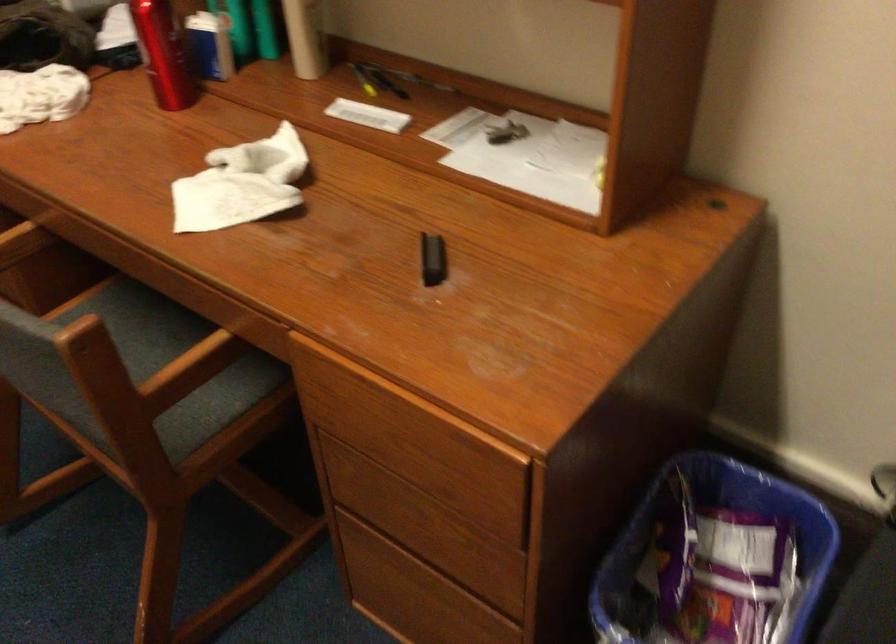
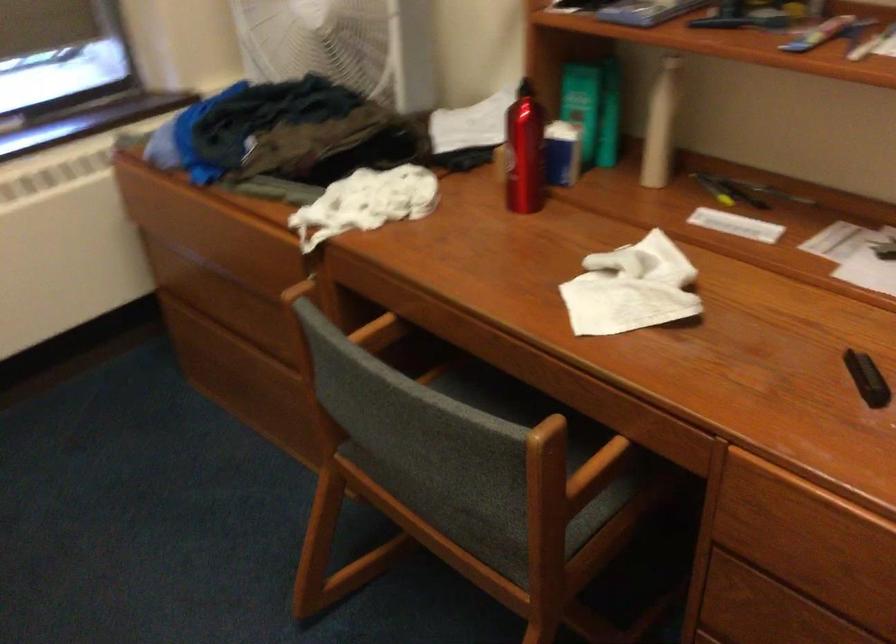
In the second image, find the point that corresponds to the point at 83,410 in the first image.

(488, 509)